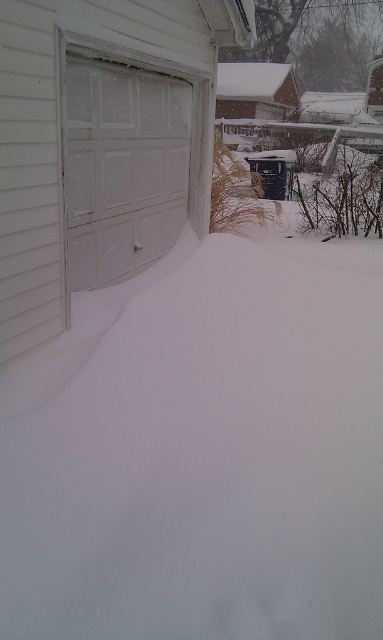
You are standing in front of the garage and see both the white matte garage door at left and the white frosted garage door at left. Which one is more to the right?

The white matte garage door at left is more to the right than the white frosted garage door at left.

You are standing in front of the garage and want to open the garage door. Which door should you push first, the white matte garage door at left or the white frosted garage door at left?

The white matte garage door at left is positioned under the white frosted garage door at left, so you should push the white frosted garage door at left first as it is the top one.

You are a delivery person trying to park your van in the driveway. The van is 2.5 meters wide. The driveway has the white matte garage door at left and the white frosted garage door at left. Can the van fit between them?

The white matte garage door at left is wider than the white frosted garage door at left. However, since both are on the left side, their widths donot determine the space between them. Therefore, it is unclear if the van can fit between them based on the provided information.